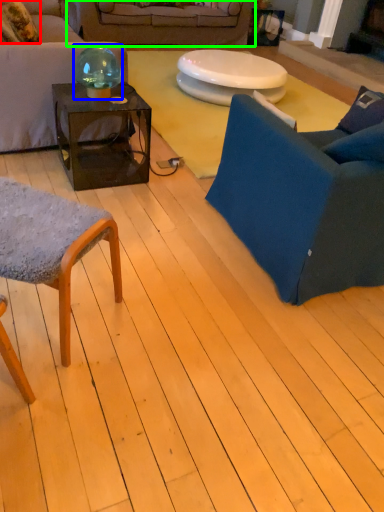
Question: Estimate the real-world distances between objects in this image. Which object is farther from pillow (highlighted by a red box), teal (highlighted by a blue box) or studio couch (highlighted by a green box)?

Choices:
 (A) teal
 (B) studio couch

Answer: (B)